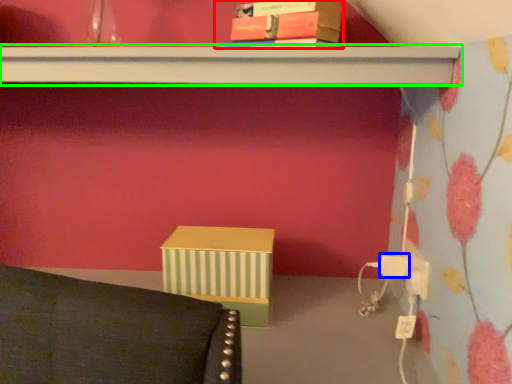
Question: Considering the real-world distances, which object is closest to book (highlighted by a red box)? plug (highlighted by a blue box) or shelf (highlighted by a green box).

Choices:
 (A) plug
 (B) shelf

Answer: (B)